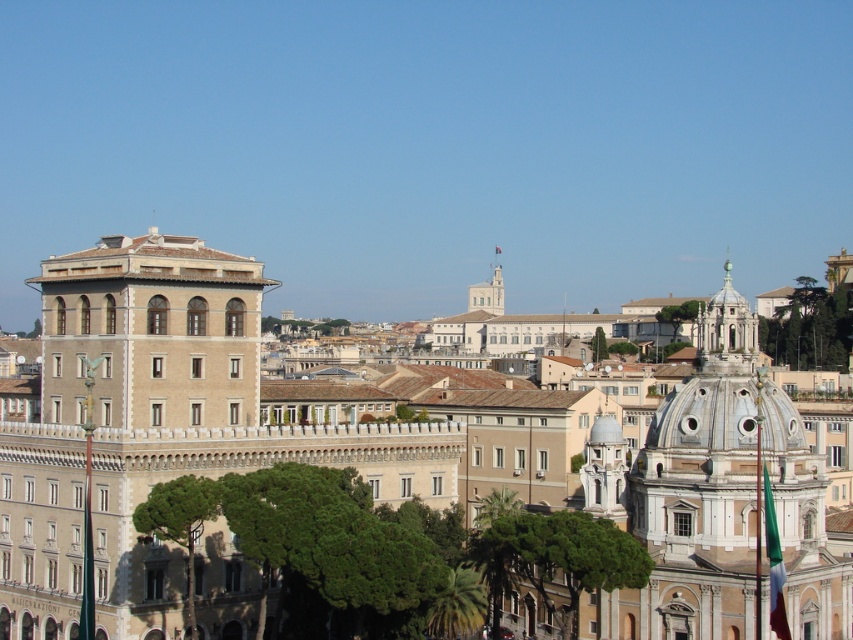
You are an architect analyzing the cityscape. You notice the beige stone building at center and the white marble dome at upper right. Which structure has a greater height?

The beige stone building at center is not as tall as the white marble dome at upper right, so the white marble dome at upper right is taller.

You are a city planner assessing the space between the beige stone building at center and the white marble dome at upper right. Given that the minimum required distance for a new pedestrian walkway is 10 meters, can the walkway be placed between them?

The beige stone building at center and the white marble dome at upper right are 12.43 meters apart, which exceeds the 10 meters requirement. Therefore, the pedestrian walkway can be placed between them.